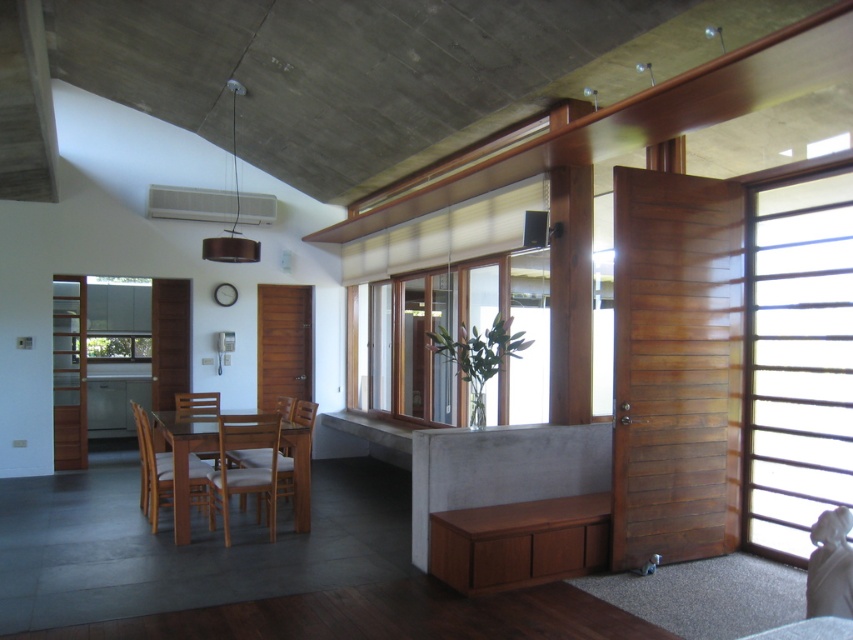
Question: Based on their relative distances, which object is nearer to the light brown wooden chair at center?

Choices:
 (A) wooden chair at center
 (B) light brown wooden table at center
 (C) wooden slats at right

Answer: (B)

Question: Which object is closer to the camera taking this photo?

Choices:
 (A) wooden chair at center
 (B) light brown wooden chair at center

Answer: (A)

Question: Is wooden slats at right positioned in front of light brown wooden chair at center?

Choices:
 (A) yes
 (B) no

Answer: (A)

Question: Which object appears farthest from the camera in this image?

Choices:
 (A) light brown wooden table at center
 (B) light brown wooden chair at center
 (C) wooden slats at right

Answer: (B)

Question: Is wooden slats at right below wooden chair at center?

Choices:
 (A) yes
 (B) no

Answer: (B)

Question: In this image, where is wooden slats at right located relative to wooden chair at center?

Choices:
 (A) left
 (B) right

Answer: (B)